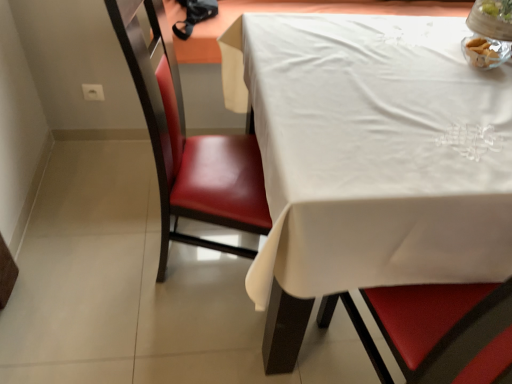
Where is `white cloth at upper right`? white cloth at upper right is located at coordinates (371, 161).

The image size is (512, 384). I want to click on clear glass bowl at upper right, so click(x=488, y=33).

Between white cloth at upper right and clear glass bowl at upper right, which one has smaller width?

Thinner between the two is clear glass bowl at upper right.

From a real-world perspective, is white cloth at upper right physically below clear glass bowl at upper right?

Yes, from a real-world perspective, white cloth at upper right is beneath clear glass bowl at upper right.

Which is further, (x=404, y=172) or (x=490, y=25)?

The point (x=490, y=25) is more distant.

From the image's perspective, is clear glass bowl at upper right located above or below leather at left?

Clearly, from the image's perspective, clear glass bowl at upper right is above leather at left.

Which is in front, clear glass bowl at upper right or leather at left?

Positioned in front is leather at left.

From a real-world perspective, is clear glass bowl at upper right located higher than leather at left?

Yes, from a real-world perspective, clear glass bowl at upper right is over leather at left

Is clear glass bowl at upper right directly adjacent to leather at left?

No, clear glass bowl at upper right is not next to leather at left.

Is leather at left thinner than white cloth at upper right?

Yes.

The width and height of the screenshot is (512, 384). In order to click on table below the leather at left (from a real-world perspective) in this screenshot , I will do `click(371, 161)`.

Would you say leather at left contains white cloth at upper right?

No, leather at left does not contain white cloth at upper right.

Is leather at left turned away from clear glass bowl at upper right?

leather at left is not turned away from clear glass bowl at upper right.

Are leather at left and clear glass bowl at upper right beside each other?

No, leather at left is not touching clear glass bowl at upper right.

Image resolution: width=512 pixels, height=384 pixels. Identify the location of tableware positioned vertically above the leather at left (from a real-world perspective). pos(488,33).

From a real-world perspective, is leather at left physically above clear glass bowl at upper right?

No, from a real-world perspective, leather at left is not on top of clear glass bowl at upper right.

Between white cloth at upper right and leather at left, which one appears on the left side from the viewer's perspective?

From the viewer's perspective, leather at left appears more on the left side.

Is white cloth at upper right next to leather at left and touching it?

No, white cloth at upper right is not beside leather at left.

Does point (238, 72) appear closer or farther from the camera than point (161, 219)?

Point (238, 72) appears to be closer to the viewer than point (161, 219).

Does clear glass bowl at upper right have a greater width compared to white cloth at upper right?

Incorrect, the width of clear glass bowl at upper right does not surpass that of white cloth at upper right.

Is clear glass bowl at upper right oriented towards white cloth at upper right?

No.

Based on the photo, is clear glass bowl at upper right inside or outside of white cloth at upper right?

clear glass bowl at upper right is not inside white cloth at upper right, it's outside.

From the image's perspective, is clear glass bowl at upper right beneath white cloth at upper right?

No, from the image's perspective, clear glass bowl at upper right is not beneath white cloth at upper right.

Identify the location of tableware behind the white cloth at upper right. The image size is (512, 384). (x=488, y=33).

Where is `chair on the left of clear glass bowl at upper right`? This screenshot has height=384, width=512. chair on the left of clear glass bowl at upper right is located at coordinates (188, 142).

In the scene shown: From the image, which object appears to be nearer to clear glass bowl at upper right, white cloth at upper right or leather at left?

Among the two, white cloth at upper right is located nearer to clear glass bowl at upper right.

Looking at the image, which one is located further to white cloth at upper right, leather at left or clear glass bowl at upper right?

Among the two, clear glass bowl at upper right is located further to white cloth at upper right.

Estimate the real-world distances between objects in this image. Which object is further from leather at left, white cloth at upper right or clear glass bowl at upper right?

clear glass bowl at upper right.

Based on their spatial positions, is clear glass bowl at upper right or white cloth at upper right closer to leather at left?

white cloth at upper right lies closer to leather at left than the other object.

Which object lies further to the anchor point clear glass bowl at upper right, leather at left or white cloth at upper right?

leather at left lies further to clear glass bowl at upper right than the other object.

Based on their spatial positions, is clear glass bowl at upper right or leather at left closer to white cloth at upper right?

Based on the image, leather at left appears to be nearer to white cloth at upper right.

The width and height of the screenshot is (512, 384). I want to click on table located between leather at left and clear glass bowl at upper right in the left-right direction, so click(x=371, y=161).